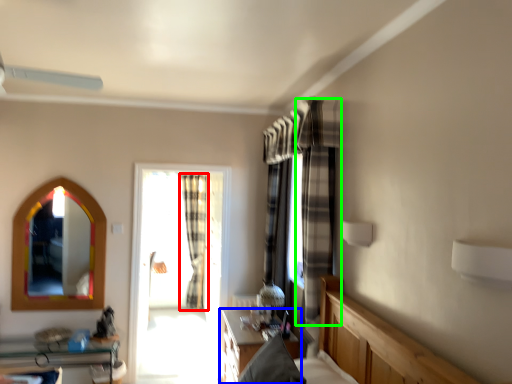
Question: Which object is the farthest from curtain (highlighted by a red box)? Choose among these: table (highlighted by a blue box) or curtain (highlighted by a green box).

Choices:
 (A) table
 (B) curtain

Answer: (B)